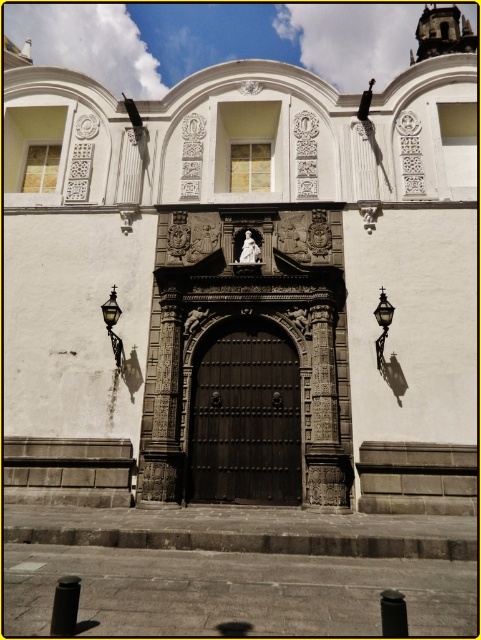
You are a visitor standing in front of the historic building. You notice the bronze textured streetlamp at left and the matte black lantern at right. Which one is positioned higher up on the building?

The bronze textured streetlamp at left is located above the matte black lantern at right, so it is positioned higher up on the building.

You are standing in front of the historic building and notice two points marked on the facade. The first point is at coordinates point (291, 342) and the second is at point (389, 321). Which point is closer to you?

Point (389, 321) is closer to you because point (291, 342) is behind it.

You are a maintenance worker needing to reach both the dark wood door at center and the bronze textured streetlamp at left with a ladder that can extend up to 5 meters. Can you safely reach both objects with the same ladder without moving it?

The dark wood door at center and bronze textured streetlamp at left are 4.84 meters apart from each other. Since the ladder can extend up to 5 meters, you can safely reach both objects with the same ladder without moving it as the distance between them is within the ladder length.